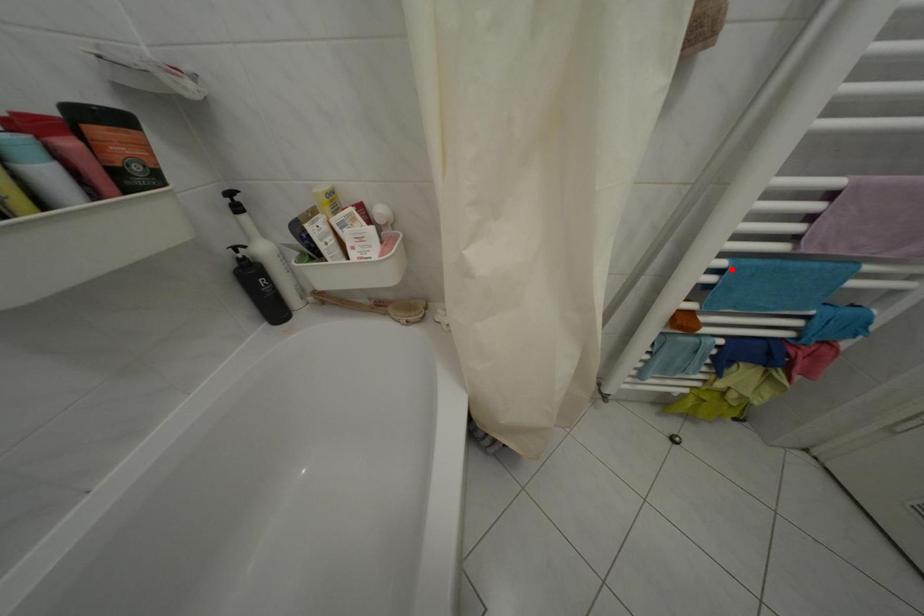
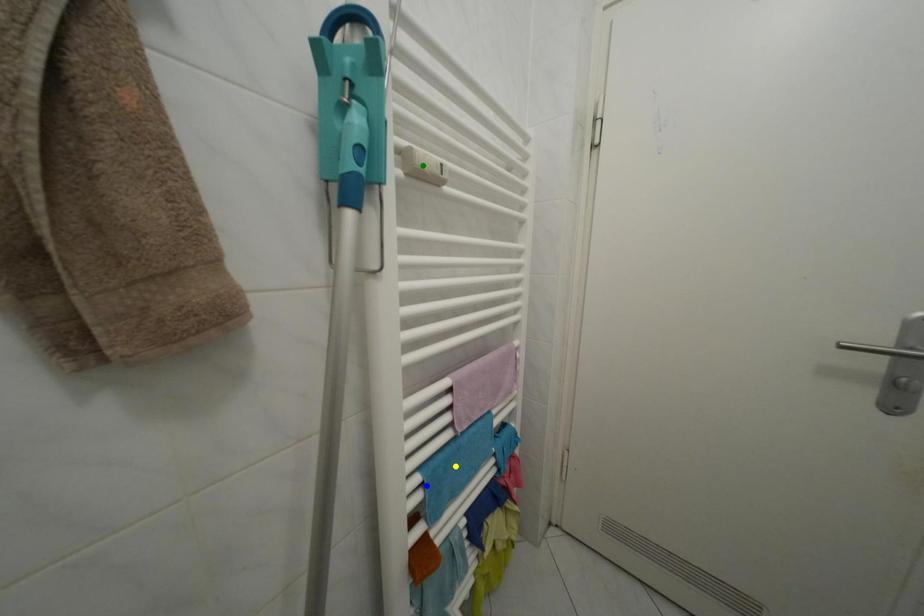
Question: I am providing you with two images of the same scene from different viewpoints. A red point is marked on the first image. You are given multiple points on the second image. Which spot in image 2 lines up with the point in image 1?

Choices:
 (A) yellow point
 (B) green point
 (C) blue point

Answer: (C)